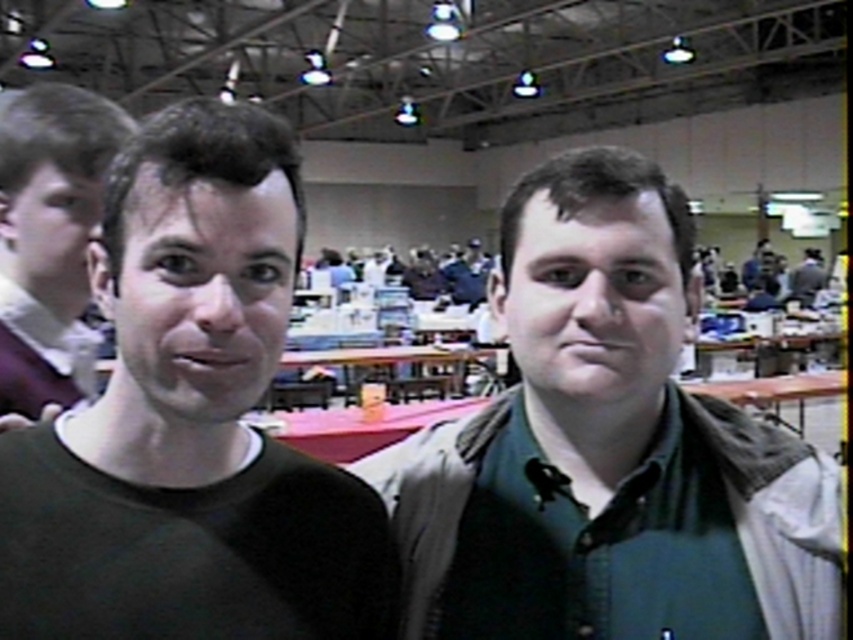
You are a photographer at the event and want to ensure that both the matte black face at left and the matte black shirt at left are clearly visible in your photo. Given their sizes, which one should you focus on to ensure it appears larger in the final image?

The matte black shirt at left occupies more space than the matte black face at left, so focusing on the matte black shirt at left would ensure it appears larger in the photo.

You are a photographer at the event and want to ensure both the green matte face at center and the matte black shirt at left are clearly visible in your photo. Based on their sizes in the image, which one might require more careful framing to avoid being too small?

The green matte face at center occupies less space than the matte black shirt at left, so it might require more careful framing to avoid being too small.

You are a photographer at the event and want to capture a clear photo of both the matte black face at left and the smooth skin face at upper left. However, you notice that one is blocking the other. Which face is currently obscuring the other?

The matte black face at left is in front of the smooth skin face at upper left, so it is obscuring the smooth skin face at upper left.